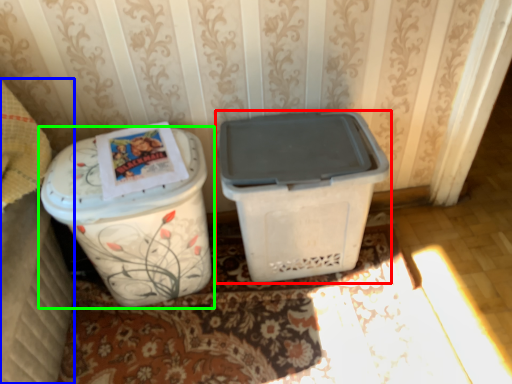
Question: Which object is positioned farthest from waste container (highlighted by a red box)? Select from leftover (highlighted by a blue box) and waste container (highlighted by a green box).

Choices:
 (A) leftover
 (B) waste container

Answer: (A)